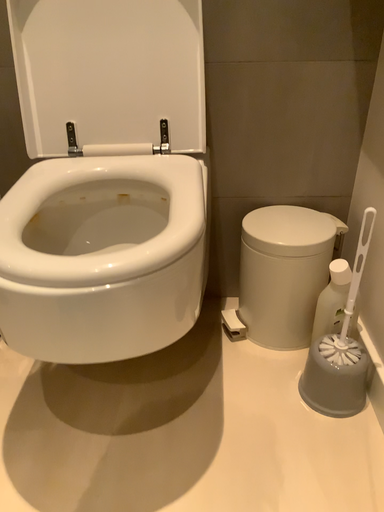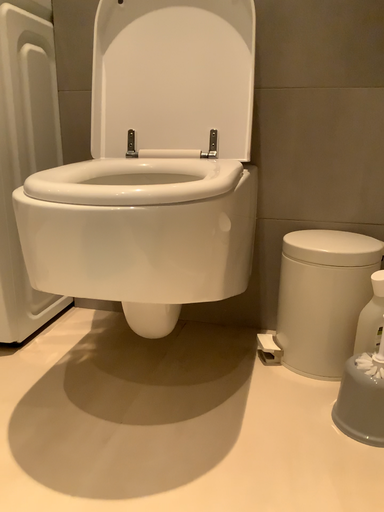
Question: How did the camera likely rotate when shooting the video?

Choices:
 (A) rotated upward
 (B) rotated downward

Answer: (A)